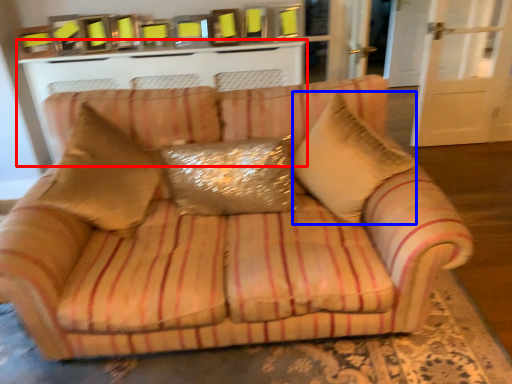
Question: Among these objects, which one is farthest to the camera, table (highlighted by a red box) or throw pillow (highlighted by a blue box)?

Choices:
 (A) table
 (B) throw pillow

Answer: (A)